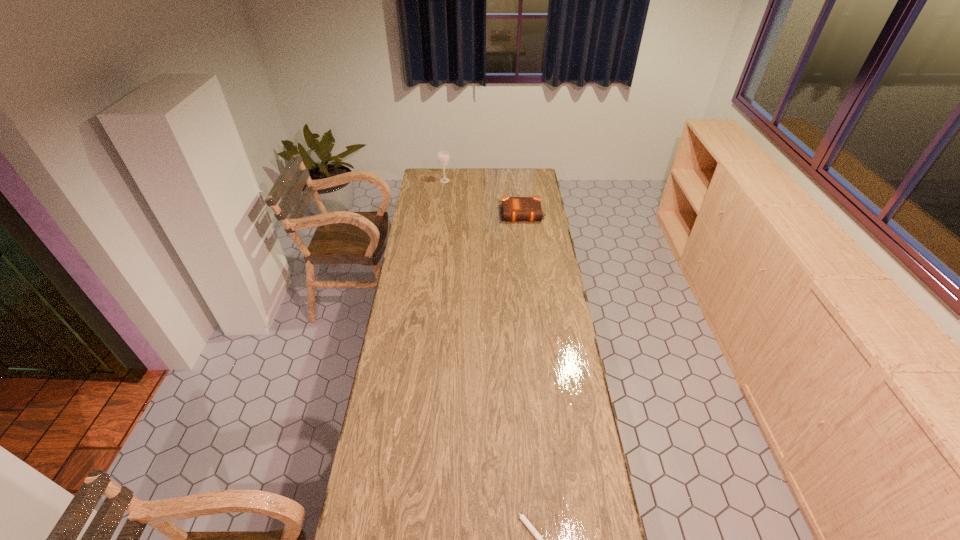
The width and height of the screenshot is (960, 540). Find the location of `the leftmost object`. the leftmost object is located at coordinates (443, 158).

I want to click on the farthest object, so click(x=443, y=158).

At what (x,y) coordinates should I click in order to perform the action: click on the second shortest object. Please return your answer as a coordinate pair (x, y). This screenshot has width=960, height=540. Looking at the image, I should click on (514, 209).

Where is `the second nearest object`? The height and width of the screenshot is (540, 960). the second nearest object is located at coordinates (514, 209).

At what (x,y) coordinates should I click in order to perform the action: click on vacant point located on the right of the farthest object. Please return your answer as a coordinate pair (x, y). This screenshot has height=540, width=960. Looking at the image, I should click on (483, 180).

The image size is (960, 540). In order to click on vacant space located 0.150m on the spine side of the second shortest object in this screenshot , I will do `click(527, 240)`.

Find the location of a particular element. The image size is (960, 540). object that is at the far edge is located at coordinates (443, 158).

Where is `object positioned at the left edge`? object positioned at the left edge is located at coordinates (443, 158).

The height and width of the screenshot is (540, 960). In order to click on object present at the right edge in this screenshot , I will do `click(514, 209)`.

At what (x,y) coordinates should I click in order to perform the action: click on object that is at the far left corner. Please return your answer as a coordinate pair (x, y). Looking at the image, I should click on (443, 158).